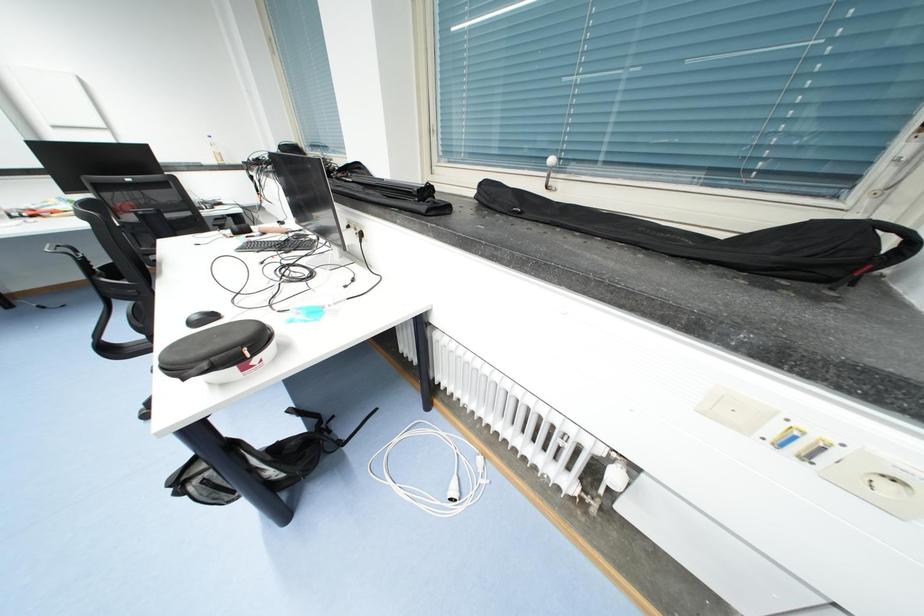
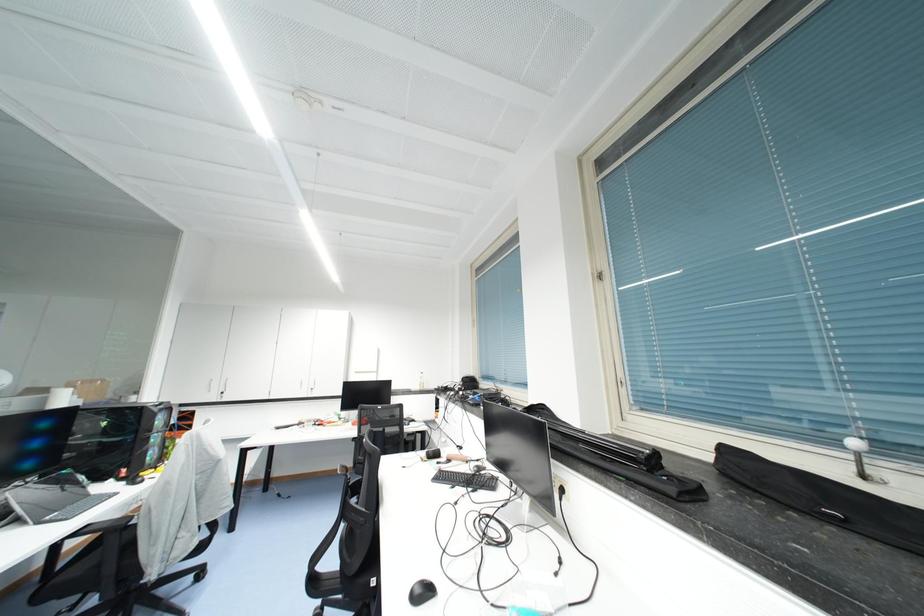
The first image is from the beginning of the video and the second image is from the end. How did the camera likely rotate when shooting the video?

The camera rotated toward left-up.